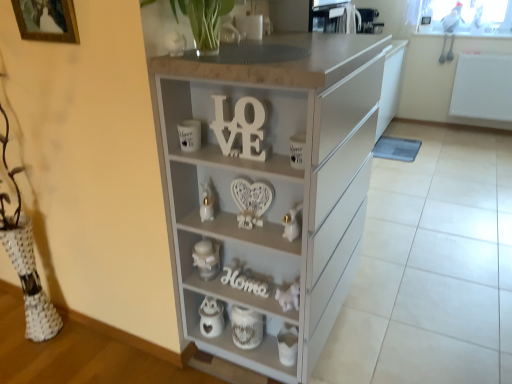
Question: Considering their positions, is white glossy rabbit at lower center, the first toy from the right, located in front of or behind white glossy rabbit at center, marked as the first toy in a back-to-front arrangement?

Choices:
 (A) behind
 (B) front

Answer: (B)

Question: From the image's perspective, relative to white glossy rabbit at center, placed as the 2th toy when sorted from right to left, is white glossy rabbit at lower center, the first toy from the right, above or below?

Choices:
 (A) below
 (B) above

Answer: (A)

Question: Considering the real-world distances, which object is farthest from the white glossy rabbit at center, which appears as the first toy when viewed from the left?

Choices:
 (A) white matte chest of drawers at center
 (B) white glossy rabbit at lower center, which appears as the first toy when viewed from the front
 (C) metallic silver toaster at upper center, which ranks as the 1th appliance in top-to-bottom order
 (D) wooden framed picture at upper left
 (E) white wood home at center, the 1th alphabet in the bottom-to-top sequence

Answer: (C)

Question: Which object is the farthest from the white glossy rabbit at lower center, the second toy in the back-to-front sequence?

Choices:
 (A) white textured ceramic jar at lower center
 (B) metallic silver toaster at upper center, which is the third appliance from bottom to top
 (C) wooden framed picture at upper left
 (D) white glossy rabbit at center, which appears as the first toy when viewed from the left
 (E) white glossy owl at lower center, acting as the 2th appliance starting from the front

Answer: (C)